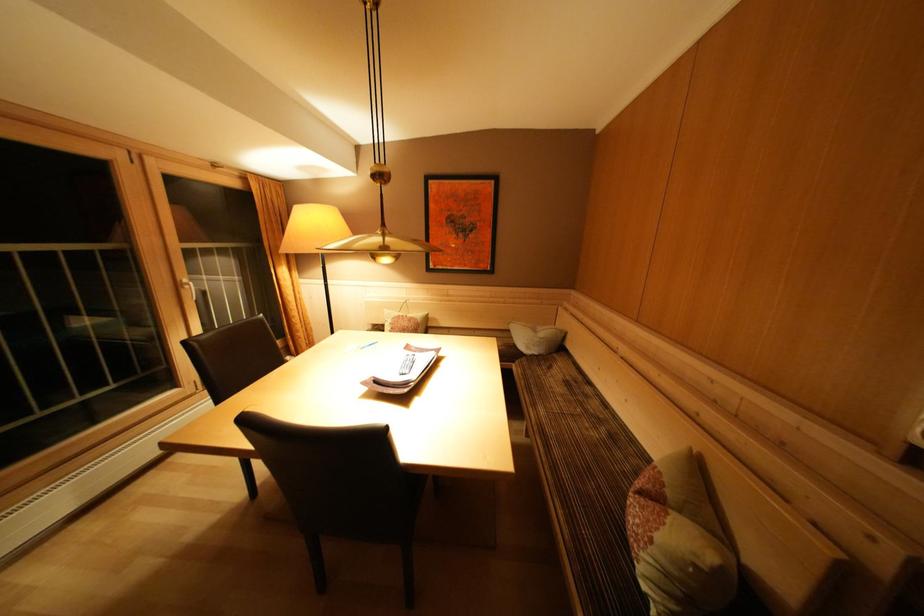
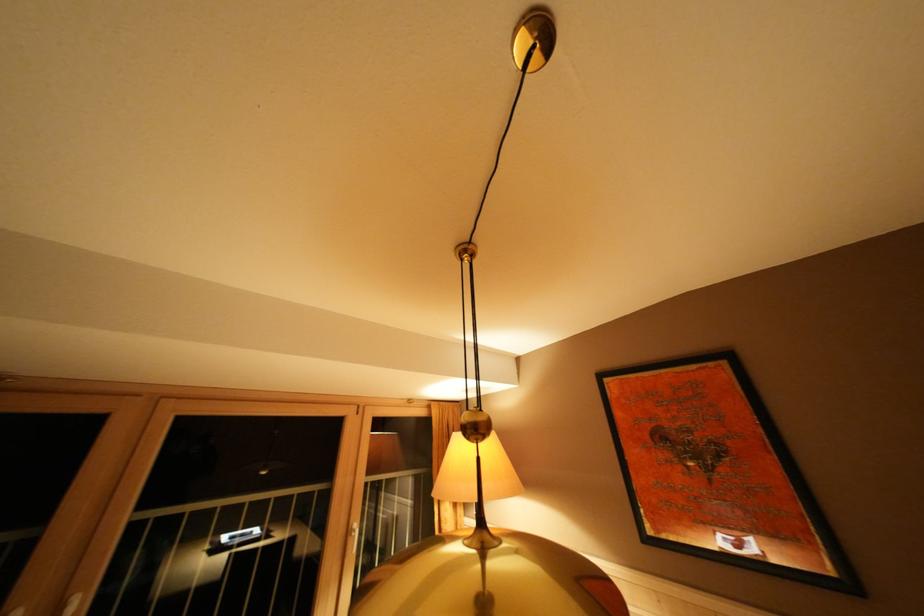
Based on the continuous images, in which direction is the camera rotating?

The camera rotated toward left-up.